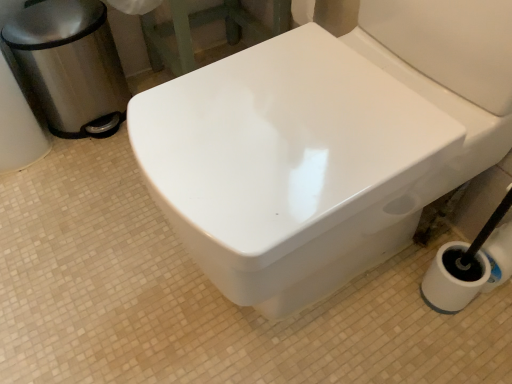
What is the approximate height of white glossy bidet at center?

white glossy bidet at center is 30.11 inches in height.

Locate an element on the screen. white glossy bidet at center is located at coordinates (289, 166).

Describe the element at coordinates (289, 166) in the screenshot. I see `white glossy bidet at center` at that location.

Measure the distance between point (187,239) and camera.

Point (187,239) is 60.60 centimeters from camera.

The height and width of the screenshot is (384, 512). In order to click on polished stainless steel trash can at left in this screenshot , I will do `click(71, 66)`.

The image size is (512, 384). Describe the element at coordinates (71, 66) in the screenshot. I see `polished stainless steel trash can at left` at that location.

What is the approximate width of polished stainless steel trash can at left?

The width of polished stainless steel trash can at left is 10.18 inches.

Where is `white glossy bidet at center`? This screenshot has width=512, height=384. white glossy bidet at center is located at coordinates (289, 166).

Considering the relative positions of polished stainless steel trash can at left and white glossy bidet at center in the image provided, is polished stainless steel trash can at left to the left of white glossy bidet at center from the viewer's perspective?

Yes.

Considering the positions of objects polished stainless steel trash can at left and white glossy bidet at center in the image provided, who is behind, polished stainless steel trash can at left or white glossy bidet at center?

polished stainless steel trash can at left is behind.

Is point (55, 0) closer or farther from the camera than point (352, 86)?

Point (55, 0) is positioned farther from the camera compared to point (352, 86).

From the image's perspective, is polished stainless steel trash can at left under white glossy bidet at center?

No, from the image's perspective, polished stainless steel trash can at left is not beneath white glossy bidet at center.

From a real-world perspective, is polished stainless steel trash can at left positioned over white glossy bidet at center based on gravity?

Actually, polished stainless steel trash can at left is physically below white glossy bidet at center in the real world.

Is polished stainless steel trash can at left wider or thinner than white glossy bidet at center?

polished stainless steel trash can at left is thinner than white glossy bidet at center.

Can you confirm if polished stainless steel trash can at left is shorter than white glossy bidet at center?

Yes, polished stainless steel trash can at left is shorter than white glossy bidet at center.

Which of these two, polished stainless steel trash can at left or white glossy bidet at center, is smaller?

polished stainless steel trash can at left is smaller.

Is white glossy bidet at center completely or partially inside polished stainless steel trash can at left?

Actually, white glossy bidet at center is outside polished stainless steel trash can at left.

Would you say polished stainless steel trash can at left is a long distance from white glossy bidet at center?

No, polished stainless steel trash can at left is not far from white glossy bidet at center.

Is polished stainless steel trash can at left oriented away from white glossy bidet at center?

polished stainless steel trash can at left is not turned away from white glossy bidet at center.

How different are the orientations of polished stainless steel trash can at left and white glossy bidet at center in degrees?

92.9 degrees.

Where is `bidet below the polished stainless steel trash can at left (from the image's perspective)`? This screenshot has height=384, width=512. bidet below the polished stainless steel trash can at left (from the image's perspective) is located at coordinates (289, 166).

Is white glossy bidet at center to the right of polished stainless steel trash can at left from the viewer's perspective?

Correct, you'll find white glossy bidet at center to the right of polished stainless steel trash can at left.

In the image, is white glossy bidet at center positioned in front of or behind polished stainless steel trash can at left?

Result: white glossy bidet at center is in front of polished stainless steel trash can at left.

Considering the points (375, 102) and (55, 108), which point is in front, point (375, 102) or point (55, 108)?

Point (375, 102)

Based on the photo, from the image's perspective, is white glossy bidet at center below polished stainless steel trash can at left?

Yes.

From a real-world perspective, is white glossy bidet at center positioned above or below polished stainless steel trash can at left?

From a real-world perspective, white glossy bidet at center is physically above polished stainless steel trash can at left.

Can you confirm if white glossy bidet at center is wider than polished stainless steel trash can at left?

Yes, white glossy bidet at center is wider than polished stainless steel trash can at left.

Who is taller, white glossy bidet at center or polished stainless steel trash can at left?

white glossy bidet at center is taller.

Who is smaller, white glossy bidet at center or polished stainless steel trash can at left?

polished stainless steel trash can at left.

Is white glossy bidet at center not within polished stainless steel trash can at left?

That's correct, white glossy bidet at center is outside of polished stainless steel trash can at left.

Is white glossy bidet at center placed right next to polished stainless steel trash can at left?

No, white glossy bidet at center is not making contact with polished stainless steel trash can at left.

Is white glossy bidet at center facing away from polished stainless steel trash can at left?

That's not correct — white glossy bidet at center is not looking away from polished stainless steel trash can at left.

How different are the orientations of white glossy bidet at center and polished stainless steel trash can at left in degrees?

The angular difference between white glossy bidet at center and polished stainless steel trash can at left is 92.9 degrees.

What are the coordinates of `garbage behind the white glossy bidet at center` in the screenshot? It's located at (71, 66).

This screenshot has height=384, width=512. In the image, there is a polished stainless steel trash can at left. Identify the location of bidet below it (from the image's perspective). (289, 166).

Find the location of a particular element. Image resolution: width=512 pixels, height=384 pixels. bidet on the right of polished stainless steel trash can at left is located at coordinates pyautogui.click(x=289, y=166).